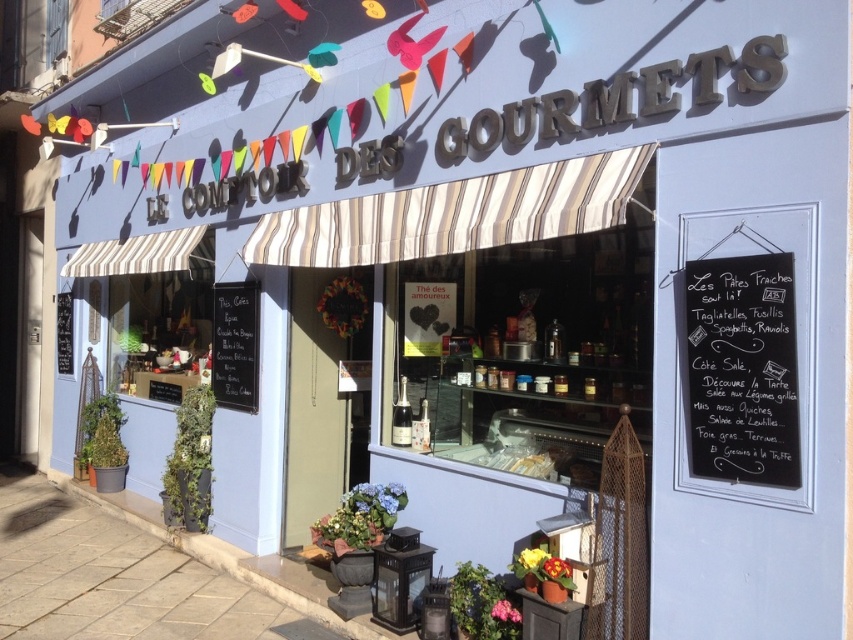
You are a customer standing at the entrance of Le Comptoir des Gourmets. You notice the sandy beige paving stone at lower left and the black chalkboard at upper right. Which object is closer to you as you face the storefront?

The sandy beige paving stone at lower left is closer to you because the black chalkboard at upper right is behind it.

You are standing in front of the gourmet shop and looking at the storefront. There are two points marked on the facade. The first point is located at coordinates point (x=83, y=509) and the second point is at point (x=685, y=380). Which point is closer to you?

Point (x=83, y=509) is closer to you because it is further to the viewer than point (x=685, y=380).